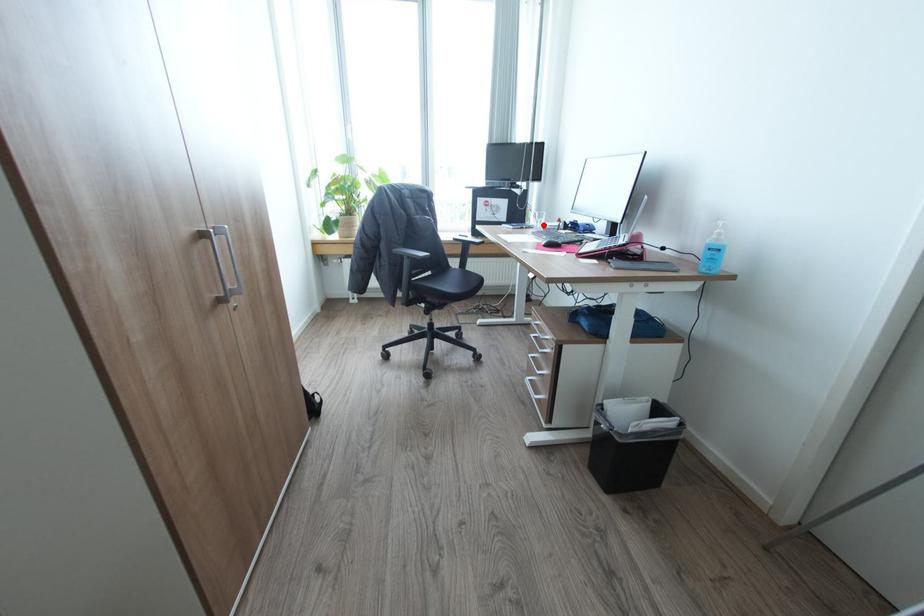
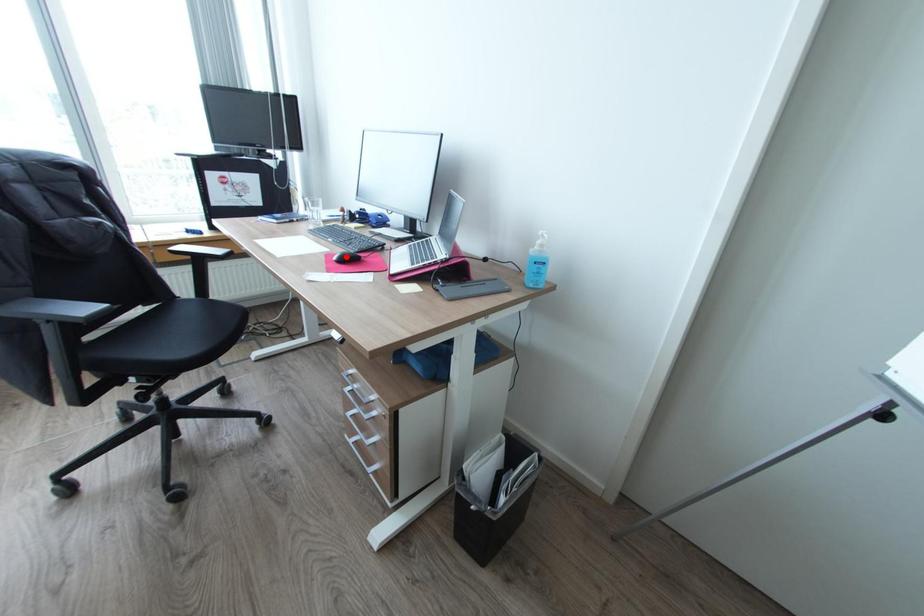
I am providing you with two images of the same scene from different viewpoints. A red point is marked on the first image and another point is marked on the second image. Do the highlighted points in image1 and image2 indicate the same real-world spot?

No